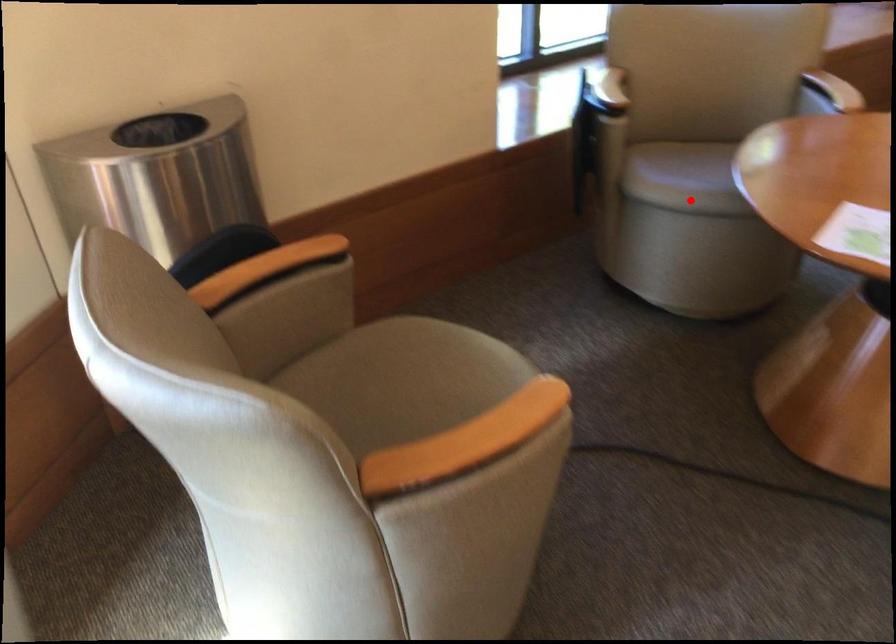
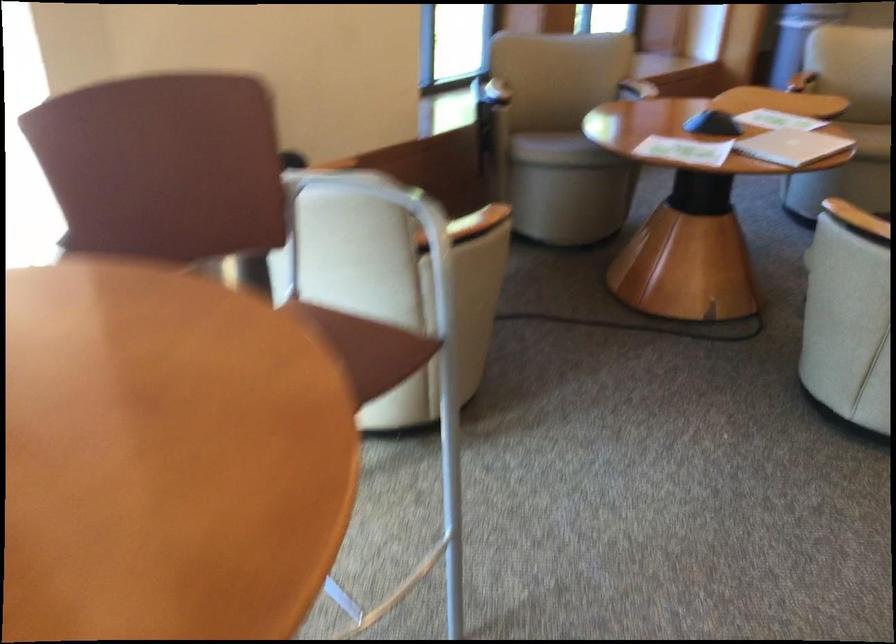
In the second image, find the point that corresponds to the highlighted location in the first image.

(561, 149)